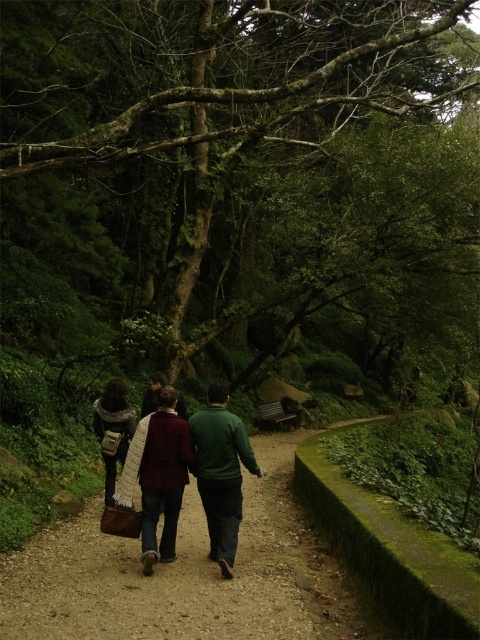
Question: Does brown gravel path at center appear over dark brown leather jacket at center?

Choices:
 (A) no
 (B) yes

Answer: (A)

Question: Which of the following is the closest to the observer?

Choices:
 (A) dark green sweater at center
 (B) green leafy tree at center

Answer: (A)

Question: Is dark green sweater at center below green matte sweater at center?

Choices:
 (A) no
 (B) yes

Answer: (B)

Question: Does green leafy tree at center appear over dark brown leather jacket at center?

Choices:
 (A) yes
 (B) no

Answer: (A)

Question: Which object is positioned farthest from the maroon woolen scarf at center?

Choices:
 (A) brown gravel path at center
 (B) green matte jacket at center
 (C) green matte sweater at center

Answer: (B)

Question: Estimate the real-world distances between objects in this image. Which object is closer to the brown gravel path at center?

Choices:
 (A) dark green sweater at center
 (B) dark brown leather jacket at center
 (C) green leafy tree at center
 (D) green matte jacket at center

Answer: (A)